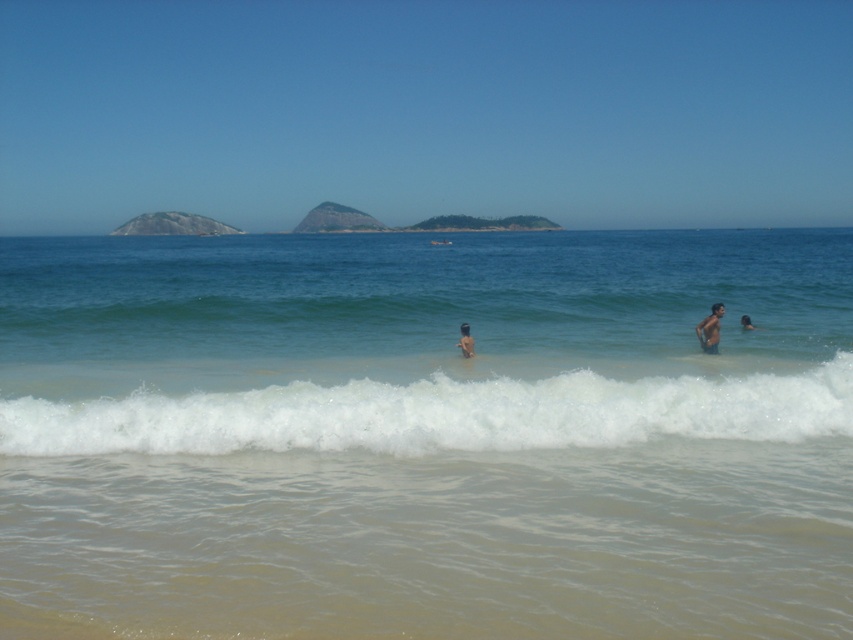
From the picture: You are a photographer planning to capture a photo of the clear blue water at center and the tan skin human at right. Based on their relative heights, which object should you focus on first to ensure proper framing?

The clear blue water at center is much taller than the tan skin human at right, so you should focus on the clear blue water at center first to ensure proper framing.

You are a photographer standing on the beach and want to capture a photo of the white foamy wave at lower center and the tan skin human at right. Based on their sizes, which object should you zoom in on to make them appear similar in size in the photo?

The white foamy wave at lower center is bigger than the tan skin human at right. To make them appear similar in size in the photo, you should zoom in on the tan skin human at right since it is smaller and needs to be magnified more compared to the larger white foamy wave at lower center.